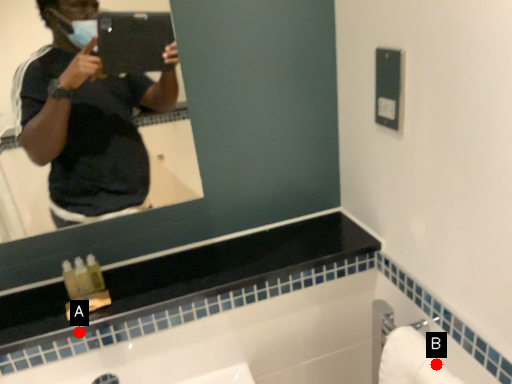
Question: Two points are circled on the image, labeled by A and B beside each circle. Which point is closer to the camera?

Choices:
 (A) A is closer
 (B) B is closer

Answer: (B)